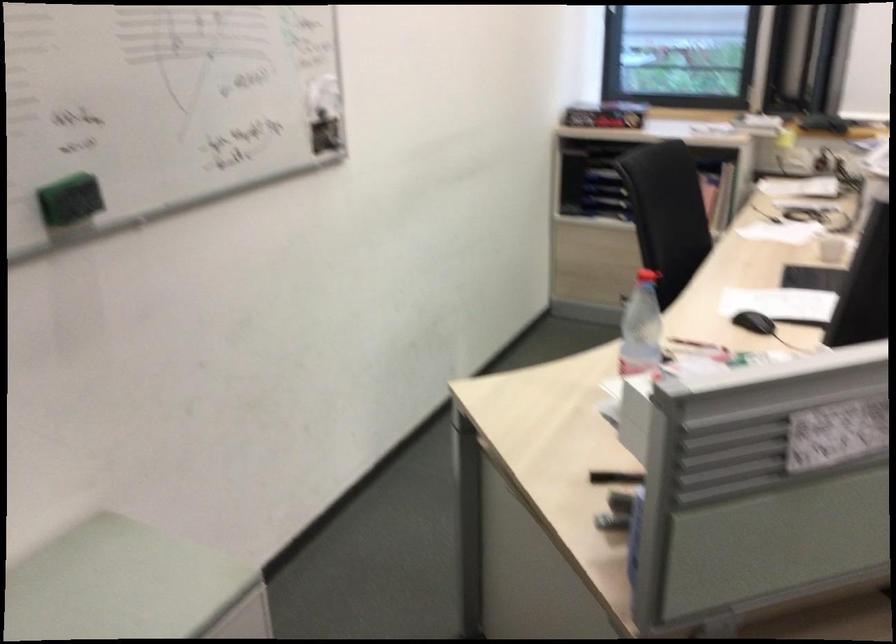
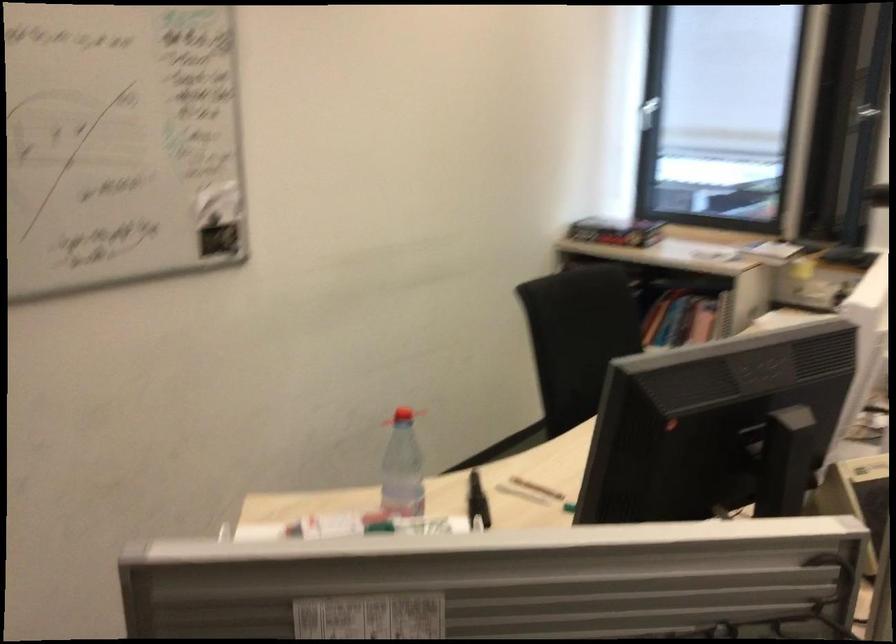
In the second image, find the point that corresponds to (636,328) in the first image.

(401, 469)